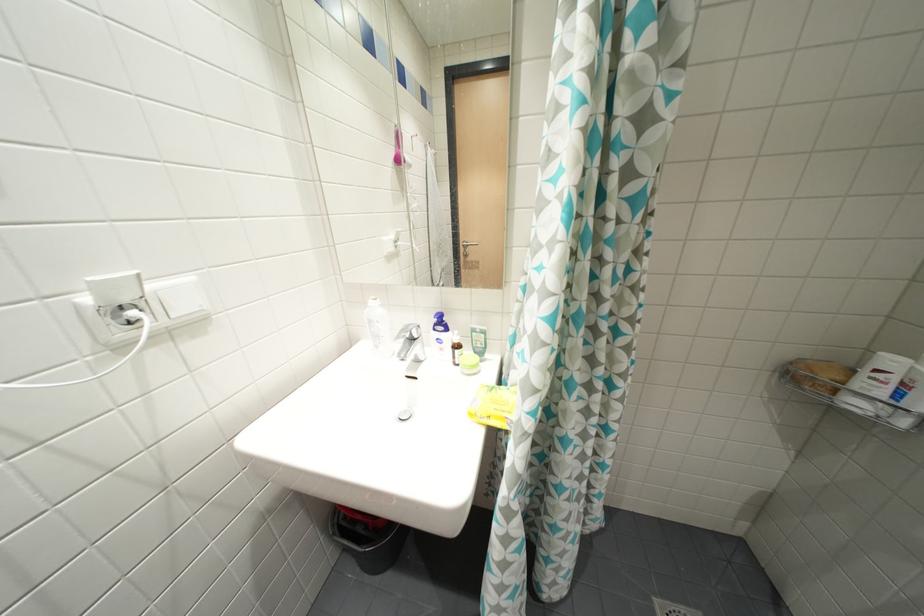
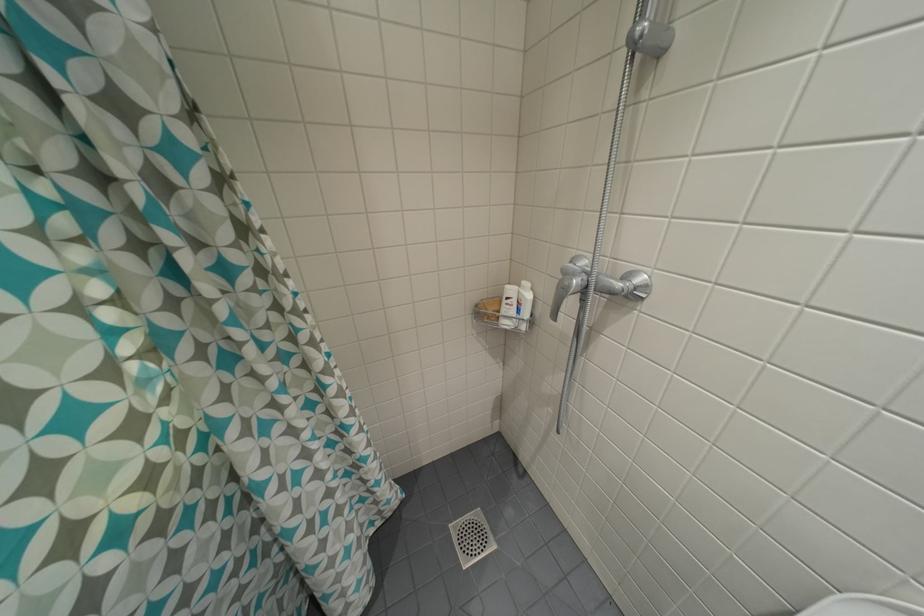
Question: The camera is either moving clockwise (left) or counter-clockwise (right) around the object. The first image is from the beginning of the video and the second image is from the end. Is the camera moving left or right when shooting the video?

Choices:
 (A) Left
 (B) Right

Answer: (A)